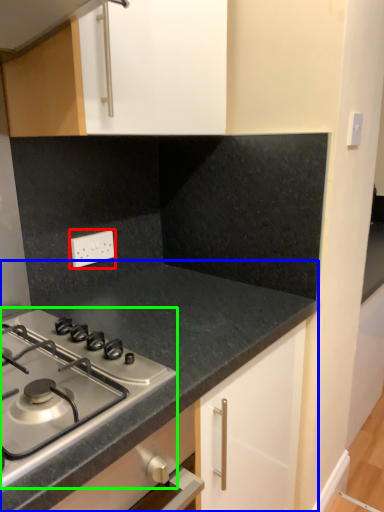
Question: Considering the real-world distances, which object is closest to electric outlet (highlighted by a red box)? countertop (highlighted by a blue box) or gas stove (highlighted by a green box).

Choices:
 (A) countertop
 (B) gas stove

Answer: (A)